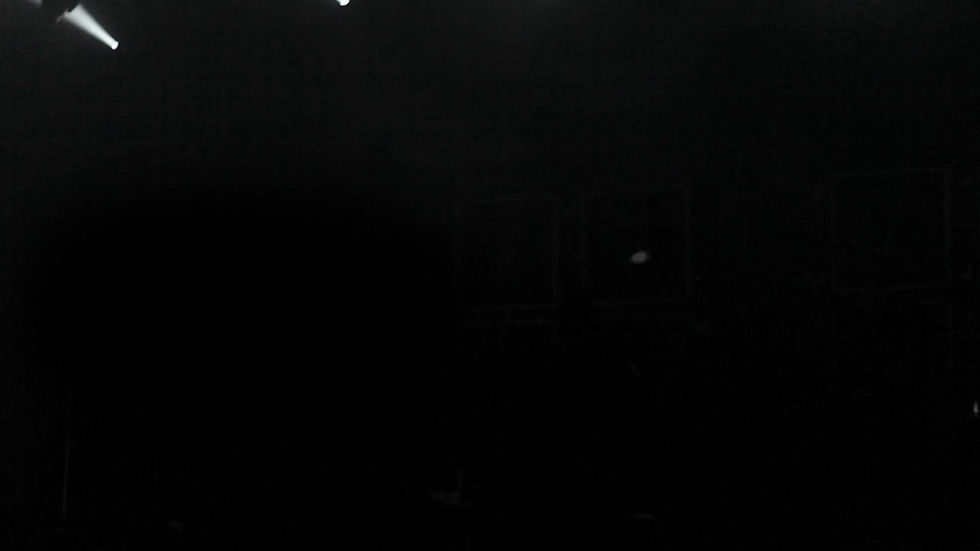
Where is `space right of spotlight`? The width and height of the screenshot is (980, 551). space right of spotlight is located at coordinates (132, 23).